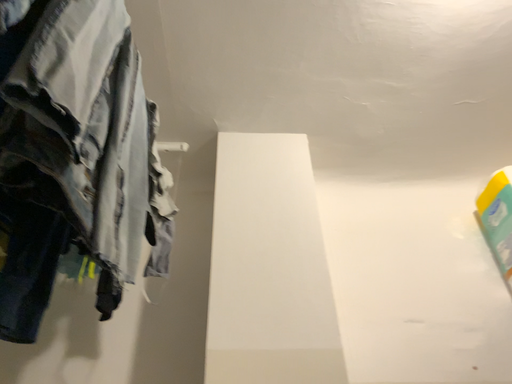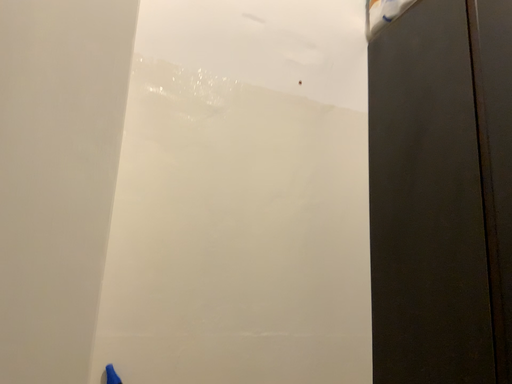
Question: Which way did the camera rotate in the video?

Choices:
 (A) rotated downward
 (B) rotated upward

Answer: (A)